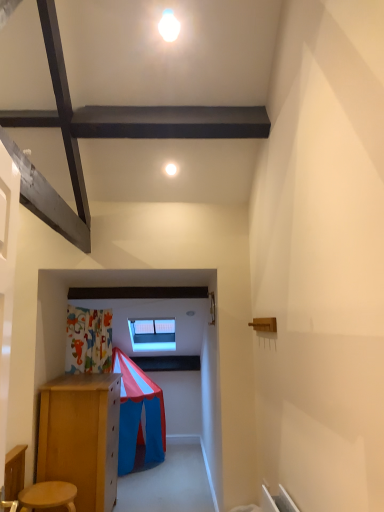
The height and width of the screenshot is (512, 384). What do you see at coordinates (48, 496) in the screenshot?
I see `wooden stool at lower left` at bounding box center [48, 496].

This screenshot has width=384, height=512. I want to click on wooden stool at lower left, so click(48, 496).

This screenshot has width=384, height=512. What do you see at coordinates (171, 169) in the screenshot?
I see `white glossy light at upper center` at bounding box center [171, 169].

Identify the location of transparent glass window at center. The image size is (384, 512). (152, 334).

Which object is wider, white glossy light at upper center or wooden stool at lower left?

With larger width is wooden stool at lower left.

Does white glossy light at upper center turn towards wooden stool at lower left?

No, white glossy light at upper center is not facing towards wooden stool at lower left.

From the picture: Does white glossy light at upper center have a greater height compared to wooden stool at lower left?

No.

Locate an element on the screen. The width and height of the screenshot is (384, 512). light behind the wooden stool at lower left is located at coordinates (171, 169).

Are wooden stool at lower left and transparent glass window at center beside each other?

wooden stool at lower left is not next to transparent glass window at center, and they're not touching.

Is wooden stool at lower left oriented away from transparent glass window at center?

No, wooden stool at lower left is not facing the opposite direction of transparent glass window at center.

Based on the photo, which object is further away from the camera taking this photo, wooden stool at lower left or transparent glass window at center?

transparent glass window at center is further away from the camera.

Is wooden stool at lower left spatially inside transparent glass window at center, or outside of it?

wooden stool at lower left is located beyond the bounds of transparent glass window at center.

Identify the location of stool in front of the white glossy light at upper center. (48, 496).

How different are the orientations of wooden stool at lower left and white glossy light at upper center in degrees?

12 degrees.

Measure the distance between wooden stool at lower left and white glossy light at upper center.

A distance of 2.16 meters exists between wooden stool at lower left and white glossy light at upper center.

Is wooden stool at lower left not inside white glossy light at upper center?

Absolutely, wooden stool at lower left is external to white glossy light at upper center.

Would you consider transparent glass window at center to be distant from white glossy light at upper center?

Yes, transparent glass window at center and white glossy light at upper center are located far from each other.

From the image's perspective, which one is positioned higher, transparent glass window at center or white glossy light at upper center?

white glossy light at upper center appears higher in the image.

Considering the sizes of objects transparent glass window at center and white glossy light at upper center in the image provided, who is taller, transparent glass window at center or white glossy light at upper center?

transparent glass window at center.

Considering the sizes of objects transparent glass window at center and wooden stool at lower left in the image provided, who is smaller, transparent glass window at center or wooden stool at lower left?

wooden stool at lower left is smaller.

Is wooden stool at lower left at the back of transparent glass window at center?

No, transparent glass window at center's orientation is not away from wooden stool at lower left.

Between point (132, 323) and point (50, 482), which one is positioned in front?

The point (50, 482) is closer.

How much distance is there between transparent glass window at center and wooden stool at lower left?

They are 8.05 feet apart.

In the scene shown: Is white glossy light at upper center in front of transparent glass window at center?

Yes, white glossy light at upper center is in front of transparent glass window at center.

Can you see white glossy light at upper center touching transparent glass window at center?

No, white glossy light at upper center is not touching transparent glass window at center.

Is white glossy light at upper center shorter than transparent glass window at center?

Correct, white glossy light at upper center is not as tall as transparent glass window at center.

Based on their sizes in the image, would you say white glossy light at upper center is bigger or smaller than transparent glass window at center?

Considering their sizes, white glossy light at upper center takes up less space than transparent glass window at center.

The image size is (384, 512). Find the location of `stool lying below the white glossy light at upper center (from the image's perspective)`. stool lying below the white glossy light at upper center (from the image's perspective) is located at coordinates (48, 496).

The height and width of the screenshot is (512, 384). I want to click on window on the right side of wooden stool at lower left, so click(x=152, y=334).

Which object lies further to the anchor point wooden stool at lower left, transparent glass window at center or white glossy light at upper center?

transparent glass window at center is further to wooden stool at lower left.

From the image, which object appears to be nearer to white glossy light at upper center, wooden stool at lower left or transparent glass window at center?

The object closer to white glossy light at upper center is wooden stool at lower left.

Based on their spatial positions, is white glossy light at upper center or transparent glass window at center further from wooden stool at lower left?

The object further to wooden stool at lower left is transparent glass window at center.

Estimate the real-world distances between objects in this image. Which object is closer to transparent glass window at center, white glossy light at upper center or wooden stool at lower left?

wooden stool at lower left.

Based on their spatial positions, is transparent glass window at center or wooden stool at lower left closer to white glossy light at upper center?

wooden stool at lower left.

Looking at the image, which one is located further to transparent glass window at center, wooden stool at lower left or white glossy light at upper center?

Based on the image, white glossy light at upper center appears to be further to transparent glass window at center.

At what (x,y) coordinates should I click in order to perform the action: click on window between white glossy light at upper center and wooden stool at lower left from top to bottom. Please return your answer as a coordinate pair (x, y). Image resolution: width=384 pixels, height=512 pixels. Looking at the image, I should click on (152, 334).